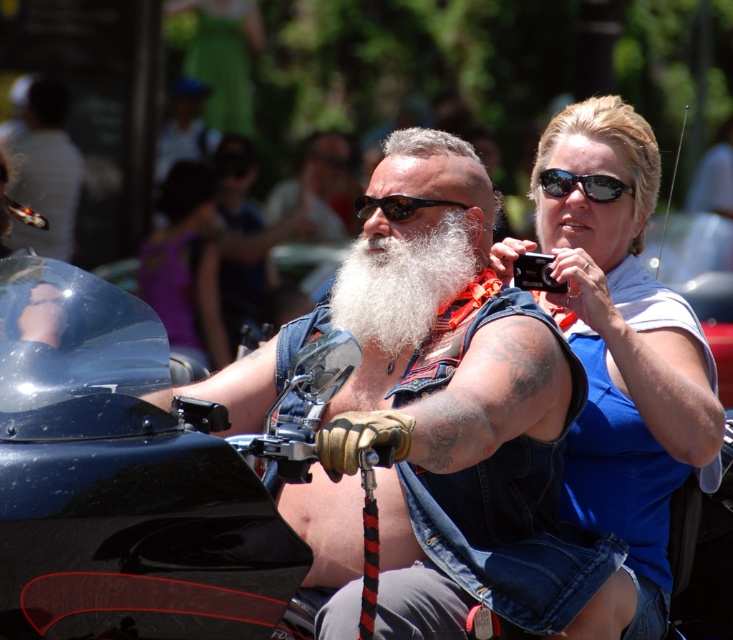
Question: Which point is closer to the camera taking this photo?

Choices:
 (A) (416, 129)
 (B) (627, 186)
 (C) (408, 200)

Answer: (C)

Question: Which object is positioned farthest from the black plastic sunglasses at upper right?

Choices:
 (A) white fluffy beard at center
 (B) sunglasses at center

Answer: (B)

Question: Which is nearer to the purple fabric dress at center?

Choices:
 (A) black plastic sunglasses at upper right
 (B) white fluffy beard at center

Answer: (A)

Question: Can you confirm if blue denim tank top at upper right is thinner than purple fabric dress at center?

Choices:
 (A) no
 (B) yes

Answer: (A)

Question: Is blue denim tank top at upper right thinner than white fluffy beard at center?

Choices:
 (A) no
 (B) yes

Answer: (A)

Question: Is purple fabric dress at center closer to camera compared to sunglasses at center?

Choices:
 (A) yes
 (B) no

Answer: (B)